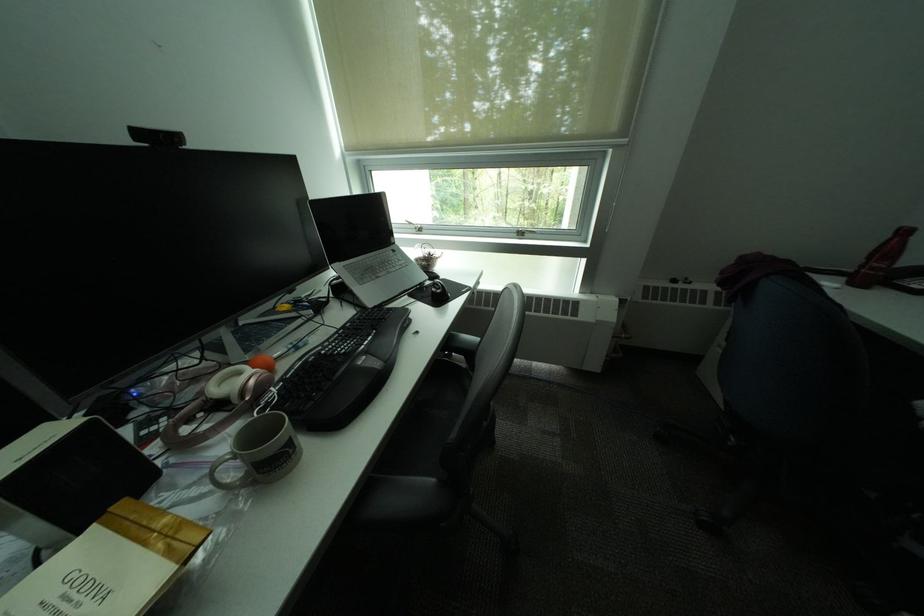
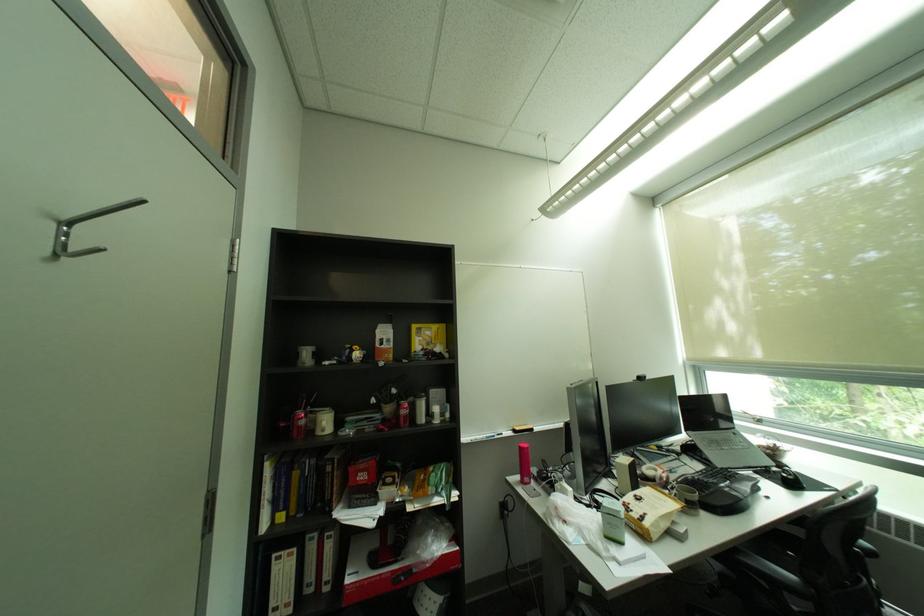
The point at (355, 328) is marked in the first image. Where is the corresponding point in the second image?

(712, 472)